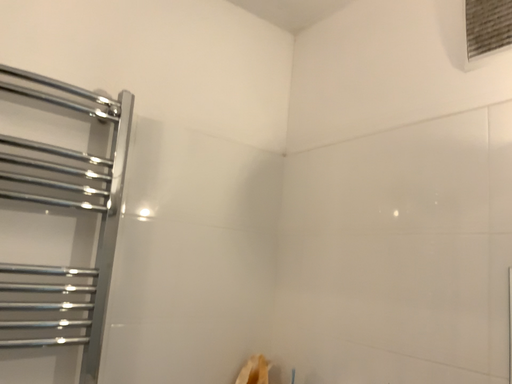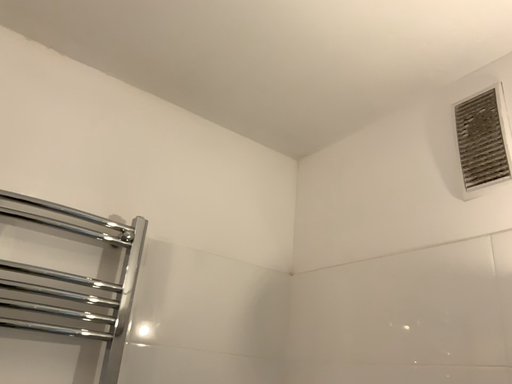
Question: Which way did the camera rotate in the video?

Choices:
 (A) rotated upward
 (B) rotated downward

Answer: (A)